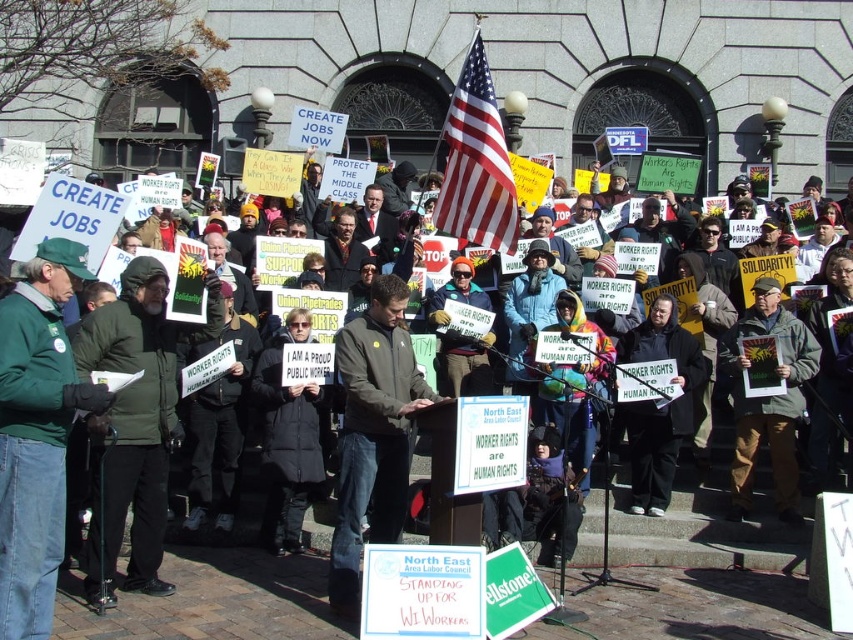
Can you confirm if red/white striped fabric flag at center is positioned below orange knit hat at center?

No, red/white striped fabric flag at center is not below orange knit hat at center.

Where is `red/white striped fabric flag at center`? The image size is (853, 640). red/white striped fabric flag at center is located at coordinates (476, 163).

What are the coordinates of `red/white striped fabric flag at center` in the screenshot? It's located at (476, 163).

Looking at this image, does green fabric jacket at center have a smaller size compared to black fabric coat at center?

No.

Does green fabric jacket at center have a greater width compared to black fabric coat at center?

Indeed, green fabric jacket at center has a greater width compared to black fabric coat at center.

Image resolution: width=853 pixels, height=640 pixels. What do you see at coordinates (769, 400) in the screenshot? I see `green fabric jacket at center` at bounding box center [769, 400].

This screenshot has width=853, height=640. I want to click on green fabric jacket at center, so click(x=769, y=400).

Image resolution: width=853 pixels, height=640 pixels. Describe the element at coordinates (373, 433) in the screenshot. I see `dark gray jacket at center` at that location.

Is dark gray jacket at center positioned before orange knit hat at center?

Yes.

Is point (387, 444) positioned in front of point (457, 369)?

Yes, it is.

Find the location of `dark gray jacket at center`. dark gray jacket at center is located at coordinates (373, 433).